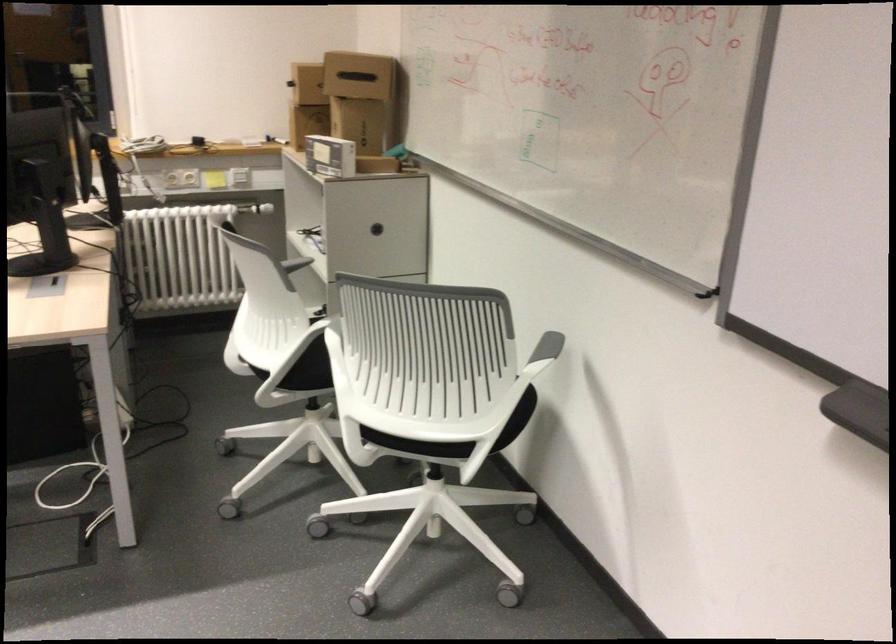
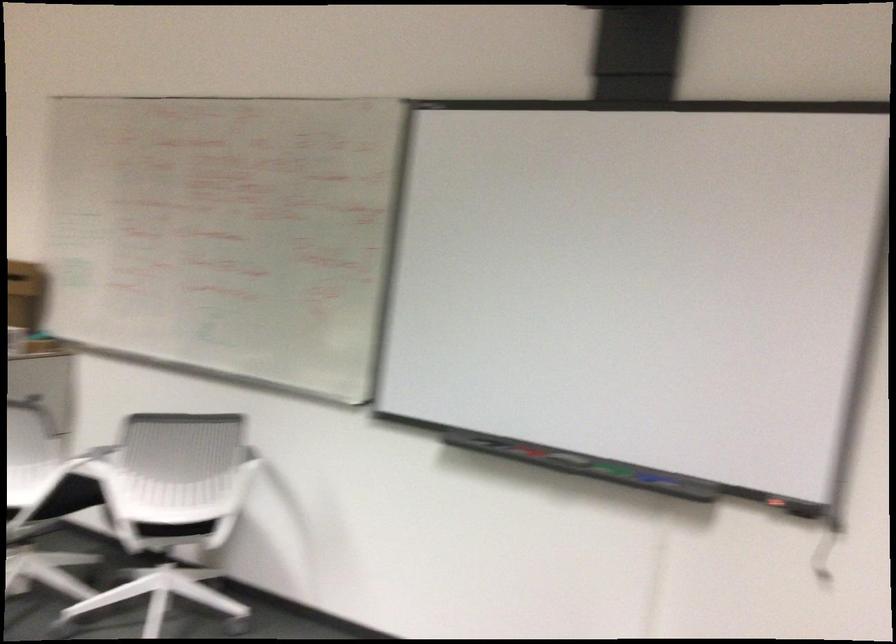
Find the pixel in the second image that matches the point at 426,439 in the first image.

(175, 529)